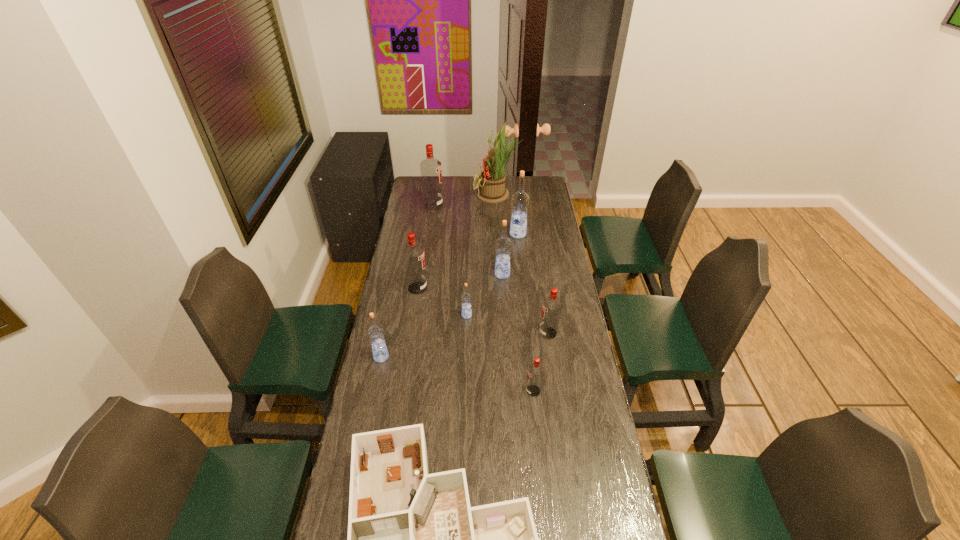
The width and height of the screenshot is (960, 540). What are the coordinates of `free space located on the front label of the biggest red vodka` in the screenshot? It's located at (479, 205).

The height and width of the screenshot is (540, 960). Find the location of `blank space located on the front of the farthest blue vodka`. blank space located on the front of the farthest blue vodka is located at coordinates (522, 272).

This screenshot has height=540, width=960. In order to click on vacant space located on the front of the second blue vodka from right to left in this screenshot , I will do `click(506, 335)`.

Locate an element on the screen. free space located 0.180m on the front label of the second biggest red vodka is located at coordinates (468, 288).

Find the location of a particular element. The height and width of the screenshot is (540, 960). free space located 0.290m on the right of the leftmost blue vodka is located at coordinates click(465, 357).

Locate an element on the screen. vacant point located on the front label of the fourth nearest object is located at coordinates (460, 333).

What are the coordinates of `free space located 0.250m on the front label of the fourth nearest object` in the screenshot? It's located at (477, 333).

Locate an element on the screen. The image size is (960, 540). vacant area situated on the front label of the fourth nearest object is located at coordinates (447, 333).

Locate an element on the screen. The image size is (960, 540). vacant space located 0.350m on the front label of the nearest vodka is located at coordinates (427, 391).

Image resolution: width=960 pixels, height=540 pixels. What are the coordinates of `vacant space located 0.230m on the front label of the nearest vodka` in the screenshot? It's located at (461, 391).